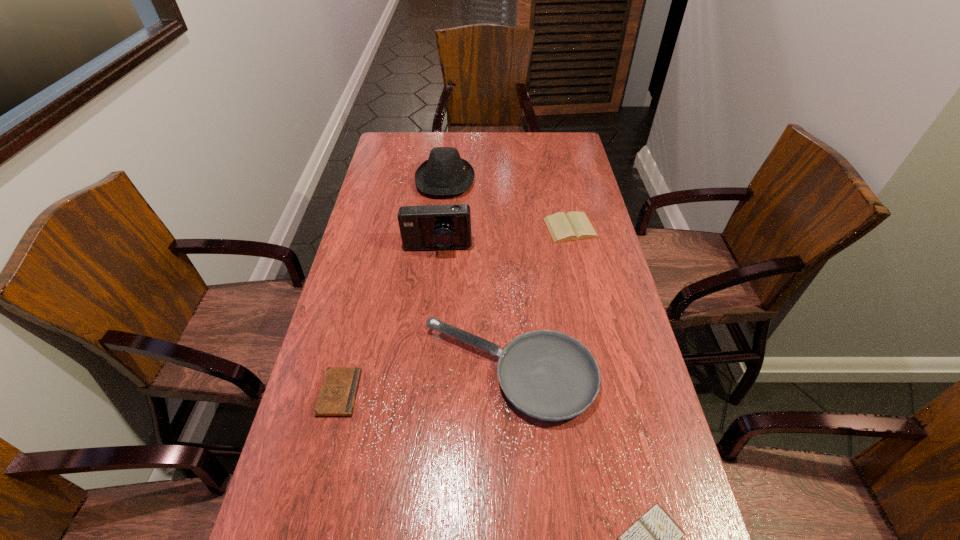
The height and width of the screenshot is (540, 960). What are the coordinates of `camera` in the screenshot? It's located at (427, 227).

Locate an element on the screen. The width and height of the screenshot is (960, 540). the farthest object is located at coordinates (444, 173).

Where is `fedora`? fedora is located at coordinates (444, 173).

In order to click on the fourth shortest object in this screenshot , I will do `click(548, 375)`.

At what (x,y) coordinates should I click in order to perform the action: click on the fourth tallest object. Please return your answer as a coordinate pair (x, y). Looking at the image, I should click on (573, 226).

The width and height of the screenshot is (960, 540). I want to click on the tallest diary, so click(573, 226).

You are a GUI agent. You are given a task and a screenshot of the screen. Output one action in this format:
    pyautogui.click(x=<x>, y=<y>)
    Task: Click on the leftmost diary
    This screenshot has height=540, width=960.
    Given the screenshot: What is the action you would take?
    pyautogui.click(x=338, y=392)

Where is `the leftmost object`? The image size is (960, 540). the leftmost object is located at coordinates (338, 392).

Where is `vacant space located 0.320m on the front-facing side of the camera`? The height and width of the screenshot is (540, 960). vacant space located 0.320m on the front-facing side of the camera is located at coordinates (428, 340).

Where is `free space located 0.120m on the front-facing side of the fedora`? The height and width of the screenshot is (540, 960). free space located 0.120m on the front-facing side of the fedora is located at coordinates (505, 180).